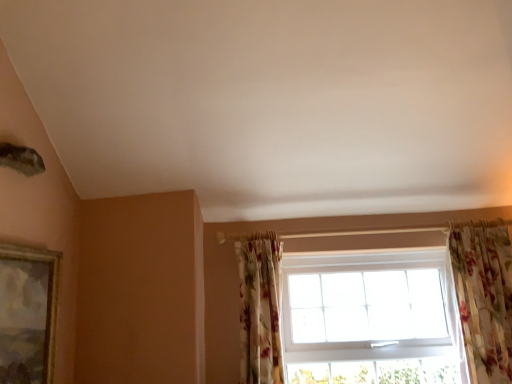
Question: Is floral fabric curtain at right, acting as the second curtain starting from the left, outside of gold-framed painting at left?

Choices:
 (A) no
 (B) yes

Answer: (B)

Question: Does floral fabric curtain at right, acting as the second curtain starting from the left, appear on the right side of gold-framed painting at left?

Choices:
 (A) no
 (B) yes

Answer: (B)

Question: Is gold-framed painting at left at the back of floral fabric curtain at right, acting as the second curtain starting from the left?

Choices:
 (A) yes
 (B) no

Answer: (B)

Question: Is floral fabric curtain at right, the 1th curtain in the right-to-left sequence, thinner than gold-framed painting at left?

Choices:
 (A) yes
 (B) no

Answer: (B)

Question: Considering the relative sizes of floral fabric curtain at right, acting as the second curtain starting from the left, and gold-framed painting at left in the image provided, is floral fabric curtain at right, acting as the second curtain starting from the left, smaller than gold-framed painting at left?

Choices:
 (A) no
 (B) yes

Answer: (A)

Question: Is floral fabric curtain at right, the 1th curtain in the right-to-left sequence, wider than gold-framed painting at left?

Choices:
 (A) no
 (B) yes

Answer: (B)

Question: Considering the relative sizes of gold-framed painting at left and floral fabric curtain at right, the 1th curtain in the right-to-left sequence, in the image provided, is gold-framed painting at left wider than floral fabric curtain at right, the 1th curtain in the right-to-left sequence,?

Choices:
 (A) yes
 (B) no

Answer: (B)

Question: From the image's perspective, is gold-framed painting at left below floral fabric curtain at right, acting as the second curtain starting from the left?

Choices:
 (A) no
 (B) yes

Answer: (A)

Question: Is floral fabric curtain at right, the 1th curtain in the right-to-left sequence, completely or partially inside gold-framed painting at left?

Choices:
 (A) no
 (B) yes

Answer: (A)

Question: Is gold-framed painting at left oriented away from floral fabric curtain at right, acting as the second curtain starting from the left?

Choices:
 (A) yes
 (B) no

Answer: (B)

Question: Is gold-framed painting at left next to floral fabric curtain at right, acting as the second curtain starting from the left?

Choices:
 (A) yes
 (B) no

Answer: (B)

Question: Is gold-framed painting at left smaller than floral fabric curtain at right, acting as the second curtain starting from the left?

Choices:
 (A) yes
 (B) no

Answer: (A)

Question: Is white plastic window at center positioned behind gold-framed painting at left?

Choices:
 (A) yes
 (B) no

Answer: (A)